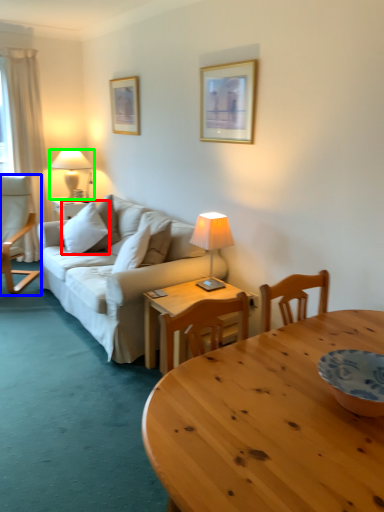
Question: Estimate the real-world distances between objects in this image. Which object is closer to pillow (highlighted by a red box), chair (highlighted by a blue box) or lamp (highlighted by a green box)?

Choices:
 (A) chair
 (B) lamp

Answer: (A)